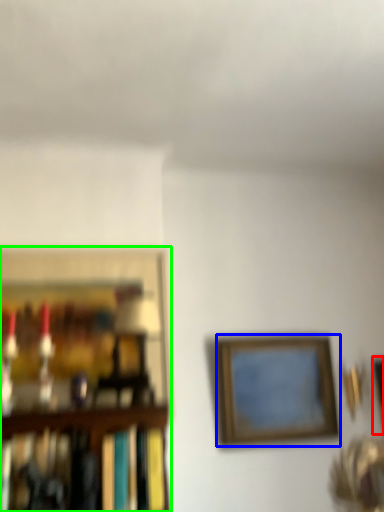
Question: Estimate the real-world distances between objects in this image. Which object is closer to picture frame (highlighted by a red box), picture frame (highlighted by a blue box) or picture frame (highlighted by a green box)?

Choices:
 (A) picture frame
 (B) picture frame

Answer: (A)